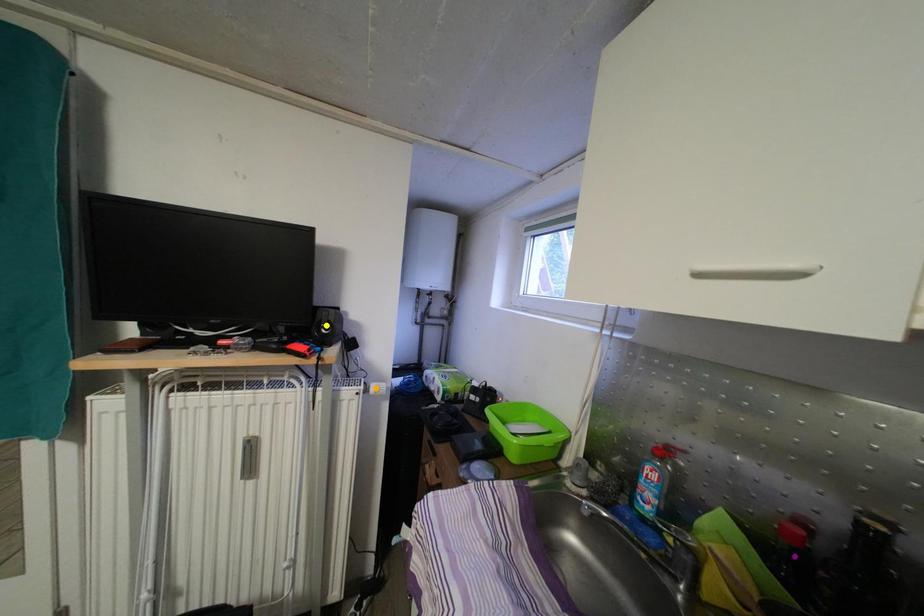
Order these from nearest to farthest:
- purple point
- orange point
- yellow point

purple point < yellow point < orange point